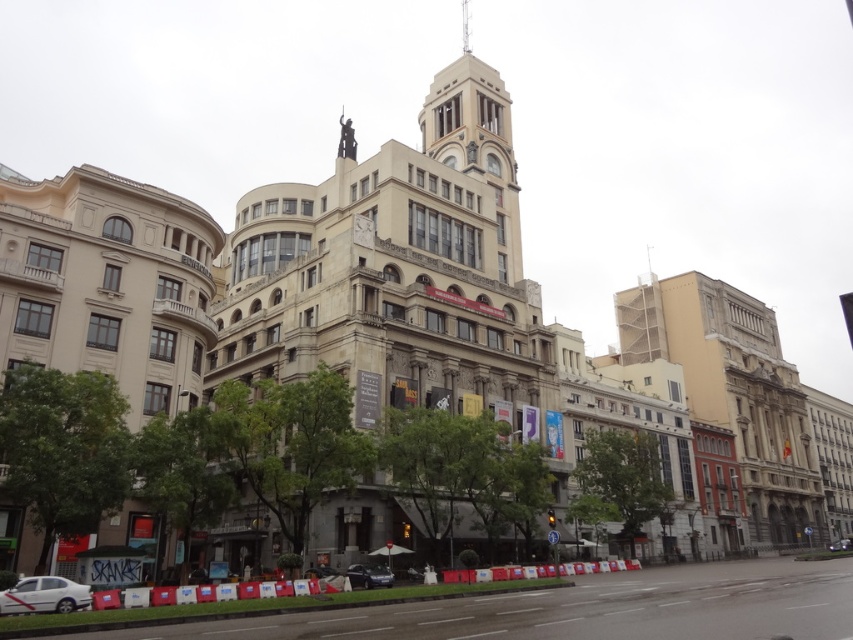
Question: Which of the following is the farthest from the observer?

Choices:
 (A) white matte car at lower left
 (B) stone tower at center
 (C) smooth concrete spire at center
 (D) shiny black sedan at lower center

Answer: (C)

Question: Is white matte car at lower left below shiny black sedan at lower center?

Choices:
 (A) yes
 (B) no

Answer: (B)

Question: Can you confirm if stone tower at center is thinner than shiny black sedan at lower center?

Choices:
 (A) no
 (B) yes

Answer: (A)

Question: From the image, what is the correct spatial relationship of stone tower at center in relation to smooth concrete spire at center?

Choices:
 (A) below
 (B) above

Answer: (A)

Question: Considering the real-world distances, which object is farthest from the shiny silver car at center?

Choices:
 (A) white matte car at lower left
 (B) shiny black sedan at lower center
 (C) smooth concrete spire at center
 (D) stone tower at center

Answer: (C)

Question: Estimate the real-world distances between objects in this image. Which object is farther from the stone tower at center?

Choices:
 (A) shiny black sedan at lower center
 (B) smooth concrete spire at center
 (C) shiny silver car at center
 (D) white matte car at lower left

Answer: (C)